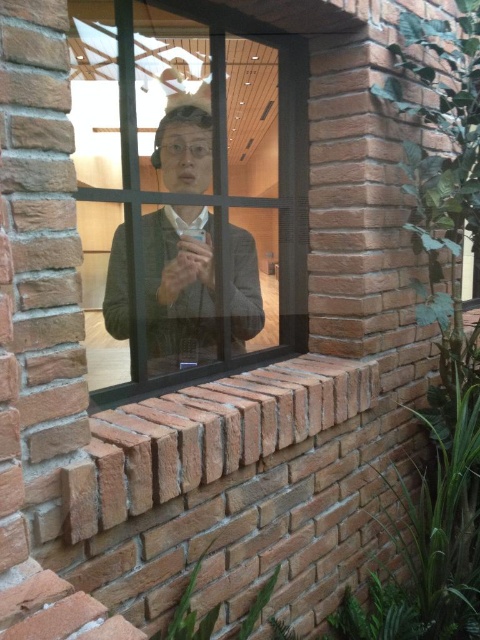
Question: Which object is farther from the camera taking this photo?

Choices:
 (A) clear glass window at center
 (B) matte gray jacket at center

Answer: (B)

Question: Is clear glass window at center smaller than matte gray jacket at center?

Choices:
 (A) yes
 (B) no

Answer: (B)

Question: Is clear glass window at center to the right of matte gray jacket at center from the viewer's perspective?

Choices:
 (A) yes
 (B) no

Answer: (A)

Question: Is clear glass window at center positioned at the back of matte gray jacket at center?

Choices:
 (A) yes
 (B) no

Answer: (B)